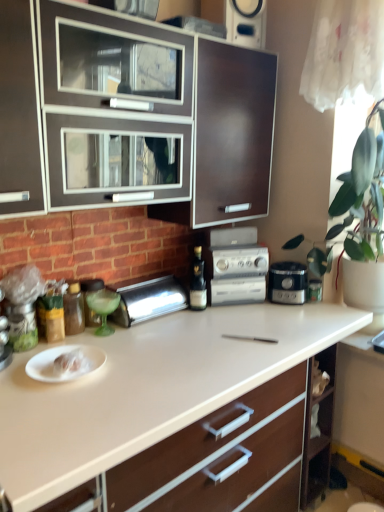
Find the location of a particular element. blank space to the left of black glass bottle at center, which ranks as the 2th bottle in left-to-right order is located at coordinates (172, 317).